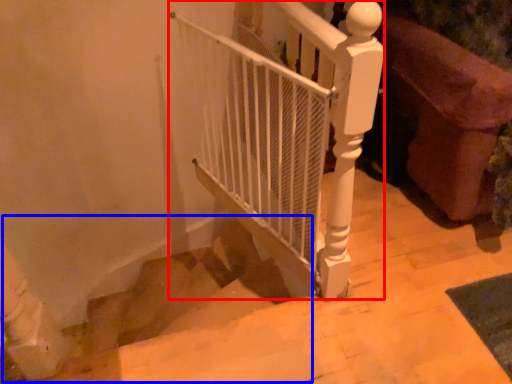
Question: Which of the following is the farthest to the observer, fence (highlighted by a red box) or stairwell (highlighted by a blue box)?

Choices:
 (A) fence
 (B) stairwell

Answer: (B)